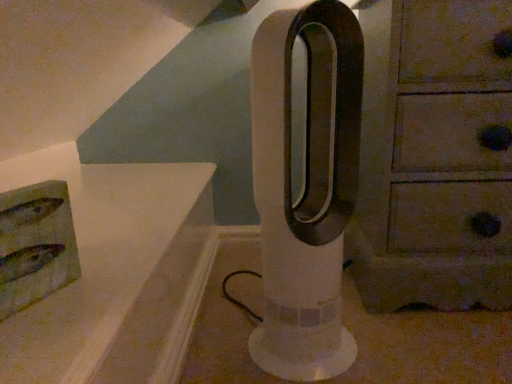
Describe the element at coordinates (304, 196) in the screenshot. I see `white plastic fan at center` at that location.

Locate an element on the screen. The height and width of the screenshot is (384, 512). white plastic fan at center is located at coordinates (304, 196).

In order to click on wooden chest of drawers at right in this screenshot , I will do `click(433, 158)`.

Based on the photo, what is the approximate height of wooden chest of drawers at right?

It is 26.32 inches.

Image resolution: width=512 pixels, height=384 pixels. What do you see at coordinates (433, 158) in the screenshot? I see `wooden chest of drawers at right` at bounding box center [433, 158].

Find the location of a particular element. white plastic fan at center is located at coordinates (304, 196).

Which object is positioned more to the right, wooden chest of drawers at right or white plastic fan at center?

wooden chest of drawers at right.

Which object is further away from the camera, wooden chest of drawers at right or white plastic fan at center?

wooden chest of drawers at right is further away from the camera.

Is point (464, 151) closer to camera compared to point (298, 340)?

That is False.

From the picture: From the image's perspective, is wooden chest of drawers at right beneath white plastic fan at center?

Incorrect, from the image's perspective, wooden chest of drawers at right is higher than white plastic fan at center.

From a real-world perspective, which is physically above, wooden chest of drawers at right or white plastic fan at center?

wooden chest of drawers at right, from a real-world perspective.

Which object is wider, wooden chest of drawers at right or white plastic fan at center?

wooden chest of drawers at right is wider.

Is wooden chest of drawers at right taller or shorter than white plastic fan at center?

wooden chest of drawers at right is taller than white plastic fan at center.

Who is bigger, wooden chest of drawers at right or white plastic fan at center?

With larger size is wooden chest of drawers at right.

Is wooden chest of drawers at right situated inside white plastic fan at center or outside?

wooden chest of drawers at right exists outside the volume of white plastic fan at center.

Is wooden chest of drawers at right with white plastic fan at center?

wooden chest of drawers at right and white plastic fan at center are not in contact.

Is wooden chest of drawers at right facing towards white plastic fan at center?

No, wooden chest of drawers at right is not aimed at white plastic fan at center.

Can you tell me how much wooden chest of drawers at right and white plastic fan at center differ in facing direction?

wooden chest of drawers at right and white plastic fan at center are facing 39.1 degrees away from each other.

Where is `pillar below the wooden chest of drawers at right (from a real-world perspective)`? pillar below the wooden chest of drawers at right (from a real-world perspective) is located at coordinates (304, 196).

Is white plastic fan at center to the left of wooden chest of drawers at right from the viewer's perspective?

Correct, you'll find white plastic fan at center to the left of wooden chest of drawers at right.

Relative to wooden chest of drawers at right, is white plastic fan at center in front or behind?

white plastic fan at center is positioned closer to the viewer than wooden chest of drawers at right.

From the picture: Which point is more distant from viewer, (263,193) or (435,84)?

The point (435,84) is behind.

From the image's perspective, is white plastic fan at center over wooden chest of drawers at right?

No.

From a real-world perspective, which object rests below the other?

white plastic fan at center.

Between white plastic fan at center and wooden chest of drawers at right, which one has larger width?

With larger width is wooden chest of drawers at right.

Is white plastic fan at center taller than wooden chest of drawers at right?

In fact, white plastic fan at center may be shorter than wooden chest of drawers at right.

Considering the sizes of objects white plastic fan at center and wooden chest of drawers at right in the image provided, who is bigger, white plastic fan at center or wooden chest of drawers at right?

Bigger between the two is wooden chest of drawers at right.

Choose the correct answer: Is white plastic fan at center inside wooden chest of drawers at right or outside it?

white plastic fan at center lies outside wooden chest of drawers at right.

From the picture: Are white plastic fan at center and wooden chest of drawers at right far apart?

white plastic fan at center is actually quite close to wooden chest of drawers at right.

Is white plastic fan at center oriented towards wooden chest of drawers at right?

No, white plastic fan at center is not oriented towards wooden chest of drawers at right.

Find the location of `pillar on the left of the wooden chest of drawers at right`. pillar on the left of the wooden chest of drawers at right is located at coordinates (304, 196).

In the image, there is a white plastic fan at center. Identify the location of the chest of drawers above it (from the image's perspective). The height and width of the screenshot is (384, 512). (433, 158).

Identify the location of chest of drawers on the right of white plastic fan at center. (433, 158).